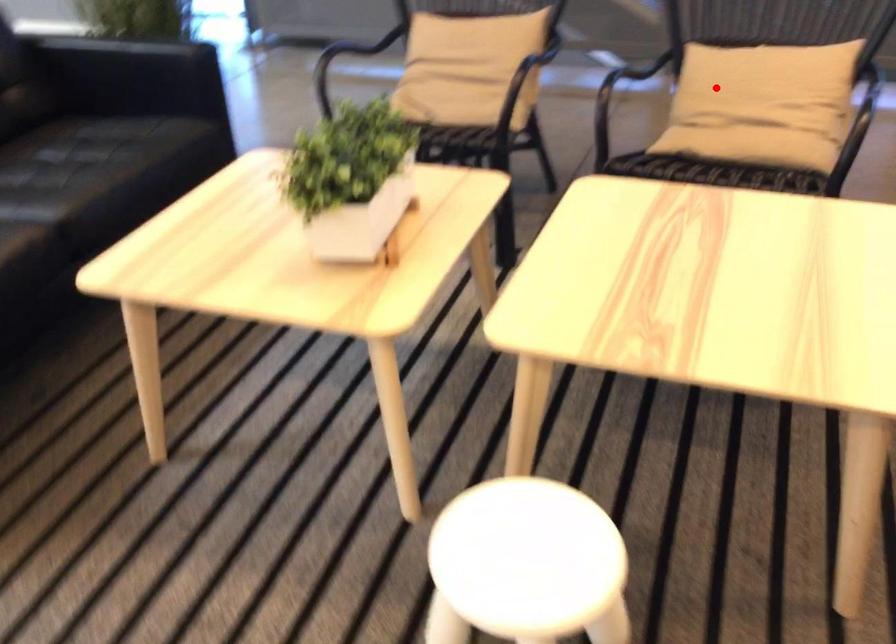
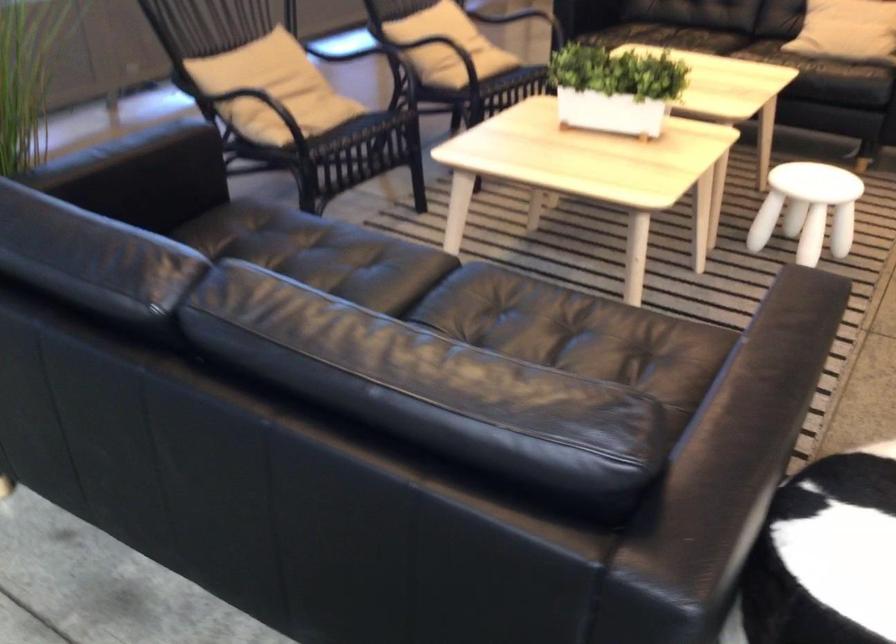
Where in the second image is the point corresponding to the highlighted location from the first image?

(433, 43)